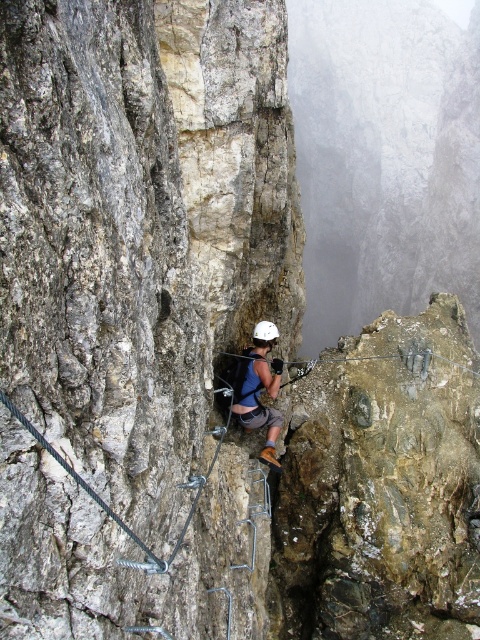
Is point (265, 461) positioned after point (273, 332)?

No, it is in front of (273, 332).

Who is positioned more to the left, blue fabric helmet at center or white matte helmet at center?

blue fabric helmet at center

I want to click on blue fabric helmet at center, so click(259, 388).

In order to click on blue fabric helmet at center in this screenshot , I will do `click(259, 388)`.

Is gray rock at center positioned in front of blue fabric helmet at center?

Yes, gray rock at center is in front of blue fabric helmet at center.

Who is taller, gray rock at center or blue fabric helmet at center?

gray rock at center

Between point (17, 13) and point (237, 404), which one is positioned in front?

Point (17, 13)

The image size is (480, 640). In order to click on gray rock at center in this screenshot , I will do `click(142, 228)`.

Is gray rock at center wider than white matte helmet at center?

Correct, the width of gray rock at center exceeds that of white matte helmet at center.

Locate an element on the screen. This screenshot has width=480, height=640. gray rock at center is located at coordinates (142, 228).

Find the location of `gray rock at center`. gray rock at center is located at coordinates (142, 228).